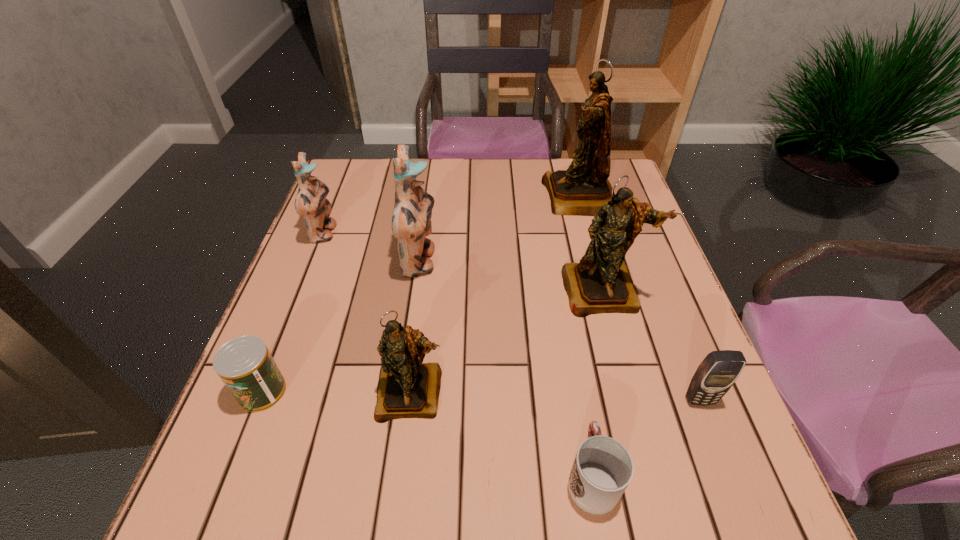
You are a GUI agent. You are given a task and a screenshot of the screen. Output one action in this format:
    pyautogui.click(x=<x>, y=<y>)
    Task: Click on the shortest object
    The image size is (960, 540).
    Given the screenshot: What is the action you would take?
    pyautogui.click(x=602, y=469)

The height and width of the screenshot is (540, 960). Find the location of `red cup`. red cup is located at coordinates (602, 469).

Identify the location of vacant space positioned on the front-facing side of the biggest gold figurine. (489, 198).

You are a GUI agent. You are given a task and a screenshot of the screen. Output one action in this format:
    pyautogui.click(x=<x>, y=<y>)
    Task: Click on the free space located 0.280m on the front-facing side of the biggest gold figurine
    Image resolution: width=960 pixels, height=540 pixels.
    Given the screenshot: What is the action you would take?
    pyautogui.click(x=447, y=198)

Identify the location of vacant space situated on the front-facing side of the biggest gold figurine. (471, 198).

Locate an element on the screen. vacant space positioned on the front-facing side of the right pink figurine is located at coordinates (499, 262).

The image size is (960, 540). I want to click on vacant region located on the front-facing side of the second smallest gold figurine, so click(x=632, y=396).

Locate an element on the screen. The width and height of the screenshot is (960, 540). vacant position located on the front-facing side of the smaller pink figurine is located at coordinates (463, 234).

The width and height of the screenshot is (960, 540). Find the location of `free region located 0.130m on the front-facing side of the smallest gold figurine`. free region located 0.130m on the front-facing side of the smallest gold figurine is located at coordinates (398, 501).

Where is `vacant space located 0.120m on the front face of the sixth tallest object`? vacant space located 0.120m on the front face of the sixth tallest object is located at coordinates (729, 474).